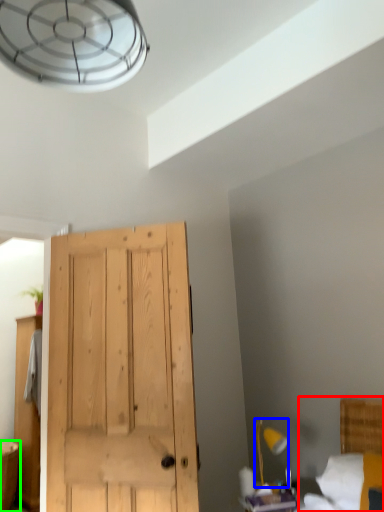
Question: Considering the real-world distances, which object is closest to bed (highlighted by a red box)? light fixture (highlighted by a blue box) or vanity (highlighted by a green box).

Choices:
 (A) light fixture
 (B) vanity

Answer: (A)